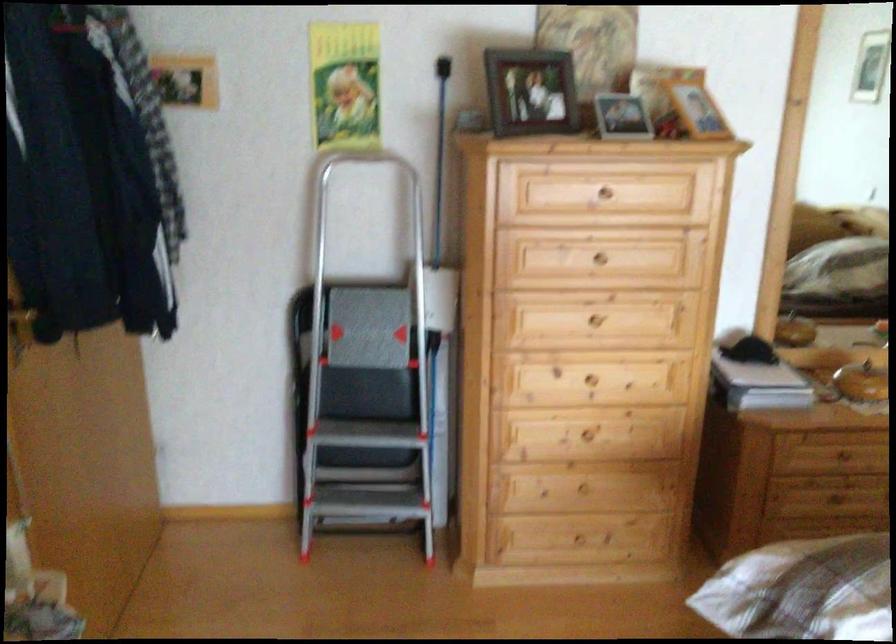
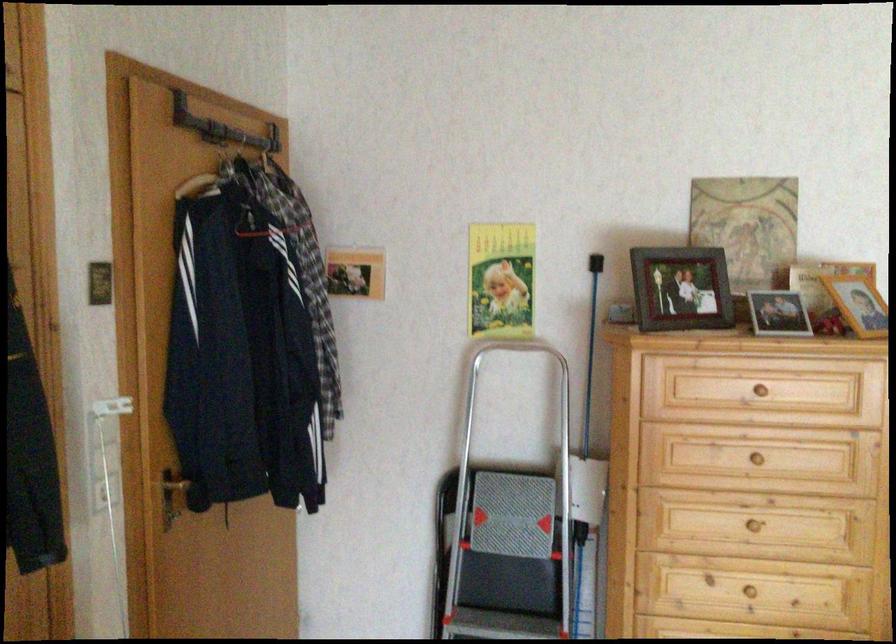
In the second image, find the point that corresponds to point 528,98 in the first image.

(681, 289)